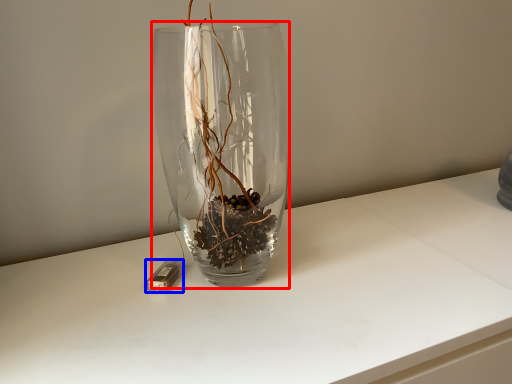
Question: Which object is closer to the camera taking this photo, vase (highlighted by a red box) or candle holder (highlighted by a blue box)?

Choices:
 (A) vase
 (B) candle holder

Answer: (A)